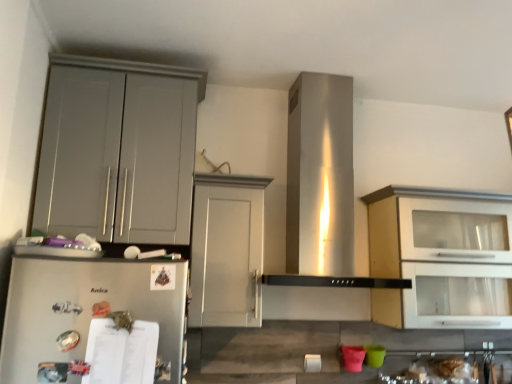
Question: Is matte gray cabinet at left, which ranks as the first cabinetry in left-to-right order, thinner than satin silver refrigerator at lower left?

Choices:
 (A) no
 (B) yes

Answer: (A)

Question: Is matte gray cabinet at left, which ranks as the first cabinetry in left-to-right order, further to camera compared to satin silver refrigerator at lower left?

Choices:
 (A) yes
 (B) no

Answer: (A)

Question: Does matte gray cabinet at left, arranged as the 3th cabinetry when viewed from the right, have a smaller size compared to satin silver refrigerator at lower left?

Choices:
 (A) no
 (B) yes

Answer: (A)

Question: Does matte gray cabinet at left, which ranks as the first cabinetry in left-to-right order, lie in front of satin silver refrigerator at lower left?

Choices:
 (A) no
 (B) yes

Answer: (A)

Question: Are matte gray cabinet at left, arranged as the 3th cabinetry when viewed from the right, and satin silver refrigerator at lower left beside each other?

Choices:
 (A) no
 (B) yes

Answer: (A)

Question: Is white matte cabinet at center, marked as the second cabinetry in a left-to-right arrangement, in front of or behind white glossy cabinet at upper right, which appears as the third cabinetry when viewed from the left, in the image?

Choices:
 (A) behind
 (B) front

Answer: (B)

Question: Does point (202, 294) appear closer or farther from the camera than point (394, 276)?

Choices:
 (A) closer
 (B) farther

Answer: (A)

Question: Considering the positions of white matte cabinet at center, the second cabinetry in the right-to-left sequence, and white glossy cabinet at upper right, marked as the 1th cabinetry in a right-to-left arrangement, in the image, is white matte cabinet at center, the second cabinetry in the right-to-left sequence, bigger or smaller than white glossy cabinet at upper right, marked as the 1th cabinetry in a right-to-left arrangement,?

Choices:
 (A) small
 (B) big

Answer: (A)

Question: From their relative heights in the image, would you say white matte cabinet at center, marked as the second cabinetry in a left-to-right arrangement, is taller or shorter than white glossy cabinet at upper right, marked as the 1th cabinetry in a right-to-left arrangement?

Choices:
 (A) short
 (B) tall

Answer: (A)

Question: From a real-world perspective, is matte gray cabinet at left, which ranks as the first cabinetry in left-to-right order, above or below satin silver refrigerator at lower left?

Choices:
 (A) below
 (B) above

Answer: (B)

Question: Would you say matte gray cabinet at left, which ranks as the first cabinetry in left-to-right order, is to the left or to the right of satin silver refrigerator at lower left in the picture?

Choices:
 (A) right
 (B) left

Answer: (B)

Question: Is matte gray cabinet at left, which ranks as the first cabinetry in left-to-right order, spatially inside satin silver refrigerator at lower left, or outside of it?

Choices:
 (A) inside
 (B) outside

Answer: (B)

Question: From the image's perspective, relative to satin silver refrigerator at lower left, is matte gray cabinet at left, arranged as the 3th cabinetry when viewed from the right, above or below?

Choices:
 (A) above
 (B) below

Answer: (A)

Question: Choose the correct answer: Is satin silver refrigerator at lower left inside matte gray cabinet at left, arranged as the 3th cabinetry when viewed from the right, or outside it?

Choices:
 (A) inside
 (B) outside

Answer: (B)

Question: From the image's perspective, is satin silver refrigerator at lower left positioned above or below matte gray cabinet at left, arranged as the 3th cabinetry when viewed from the right?

Choices:
 (A) above
 (B) below

Answer: (B)